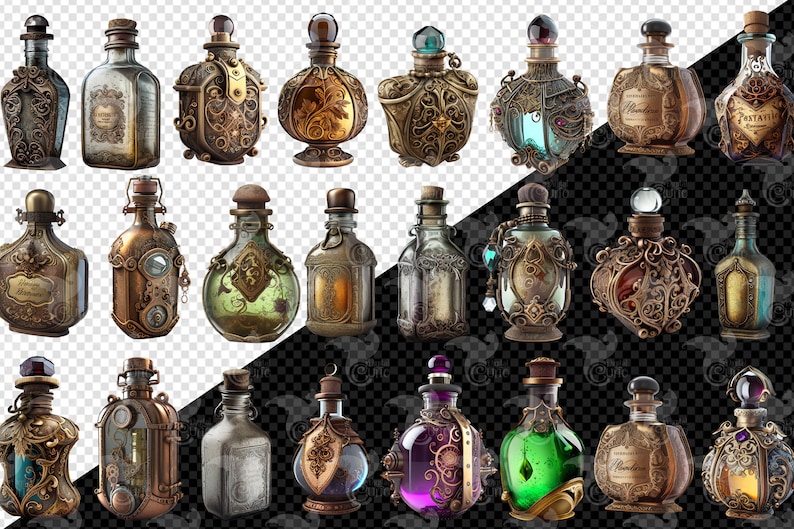
Where is `top row of potion bottles with 8 total in row`? This screenshot has height=529, width=794. top row of potion bottles with 8 total in row is located at coordinates (44, 114).